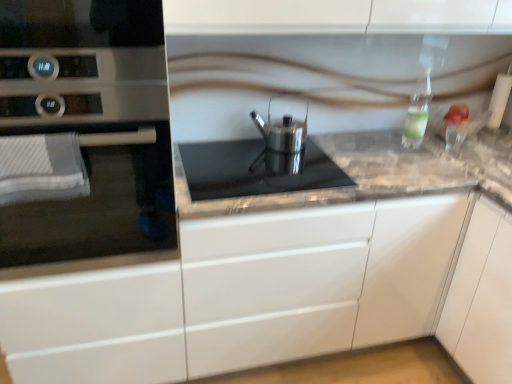
Question: Is satin silver cookware at center directly adjacent to satin silver oven at left?

Choices:
 (A) no
 (B) yes

Answer: (A)

Question: From a real-world perspective, is satin silver cookware at center under satin silver oven at left?

Choices:
 (A) no
 (B) yes

Answer: (B)

Question: Considering the relative sizes of satin silver cookware at center and satin silver oven at left in the image provided, is satin silver cookware at center thinner than satin silver oven at left?

Choices:
 (A) yes
 (B) no

Answer: (A)

Question: Can you confirm if satin silver cookware at center is positioned to the right of satin silver oven at left?

Choices:
 (A) yes
 (B) no

Answer: (A)

Question: From a real-world perspective, is satin silver cookware at center on satin silver oven at left?

Choices:
 (A) yes
 (B) no

Answer: (B)

Question: From the image's perspective, would you say satin silver cookware at center is positioned over satin silver oven at left?

Choices:
 (A) no
 (B) yes

Answer: (A)

Question: Is satin silver cookware at center not close to marble gray counter at center?

Choices:
 (A) yes
 (B) no

Answer: (B)

Question: From a real-world perspective, is satin silver cookware at center located higher than marble gray counter at center?

Choices:
 (A) no
 (B) yes

Answer: (B)

Question: Is marble gray counter at center a part of satin silver cookware at center?

Choices:
 (A) no
 (B) yes

Answer: (A)

Question: Considering the relative positions of satin silver cookware at center and marble gray counter at center in the image provided, is satin silver cookware at center to the left of marble gray counter at center from the viewer's perspective?

Choices:
 (A) no
 (B) yes

Answer: (B)

Question: Is satin silver cookware at center oriented away from marble gray counter at center?

Choices:
 (A) yes
 (B) no

Answer: (A)

Question: Does satin silver cookware at center have a larger size compared to marble gray counter at center?

Choices:
 (A) yes
 (B) no

Answer: (B)

Question: From a real-world perspective, is satin silver kettle at center physically below satin silver cookware at center?

Choices:
 (A) no
 (B) yes

Answer: (A)